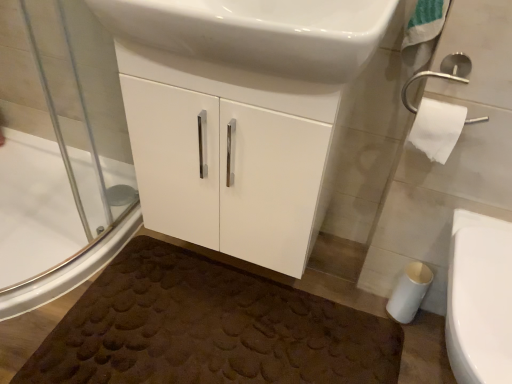
I want to click on vacant space in front of white matte toilet paper at lower right, which is counted as the first toilet paper, starting from the back, so click(411, 343).